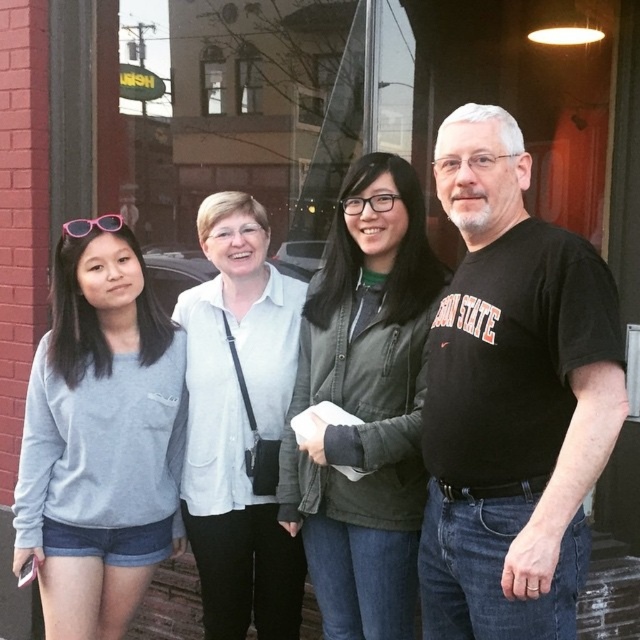
You are a photographer trying to capture a group photo. You notice the white matte shirt at center and the pink plastic sunglasses at upper left. Which object should you focus on to ensure it fits entirely within the frame if your camera has a limited field of view?

The white matte shirt at center is wider than the pink plastic sunglasses at upper left, so focusing on the white matte shirt at center would ensure it fits within the frame while also including the smaller sunglasses.

You are a photographer trying to capture a clear photo of the gray cotton sweatshirt at left. However, the green matte jacket at center is blocking your view. Can you move around to the side to get an unobstructed shot?

The green matte jacket at center is in front of the gray cotton sweatshirt at left, so moving to the side might allow you to see around the green matte jacket at center and capture the gray cotton sweatshirt at left without obstruction.